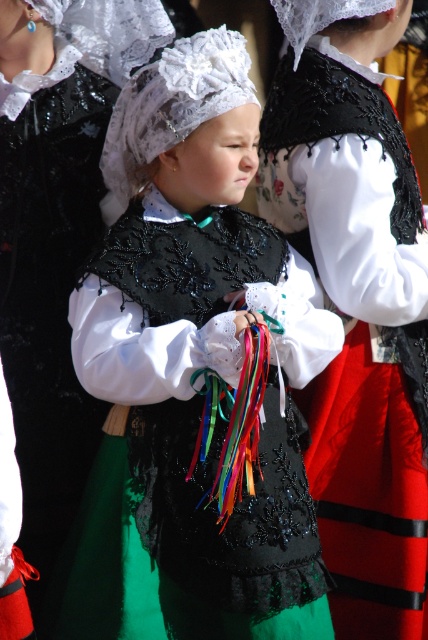
Question: Which point is closer to the camera?

Choices:
 (A) (42, 45)
 (B) (287, 266)
 (C) (366, 579)

Answer: (B)

Question: Can you confirm if matte black vest at center is wider than black lace vest at center?

Choices:
 (A) yes
 (B) no

Answer: (A)

Question: Which object appears farthest from the camera in this image?

Choices:
 (A) matte black vest at center
 (B) black lace vest at center

Answer: (B)

Question: Can you confirm if black lace vest at center is positioned to the left of matte black dress at center?

Choices:
 (A) no
 (B) yes

Answer: (A)

Question: Among these objects, which one is nearest to the camera?

Choices:
 (A) black lace vest at center
 (B) matte black vest at center
 (C) matte black dress at center

Answer: (B)

Question: Is matte black vest at center to the right of matte black dress at center from the viewer's perspective?

Choices:
 (A) no
 (B) yes

Answer: (B)